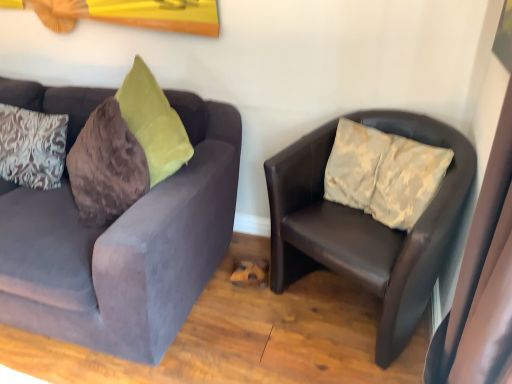
Image resolution: width=512 pixels, height=384 pixels. Identify the location of vacant region to the left of leather chair at right, acting as the 1th studio couch starting from the right. (240, 329).